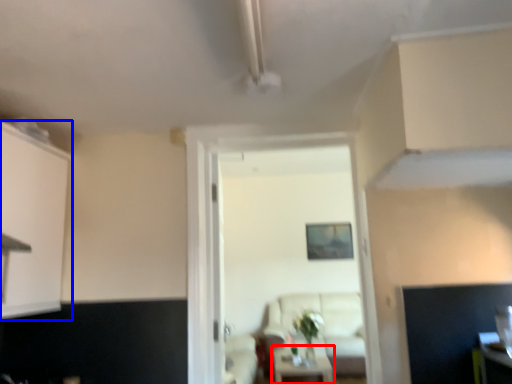
Question: Which point is further to the camera, table (highlighted by a red box) or cabinetry (highlighted by a blue box)?

Choices:
 (A) table
 (B) cabinetry

Answer: (A)